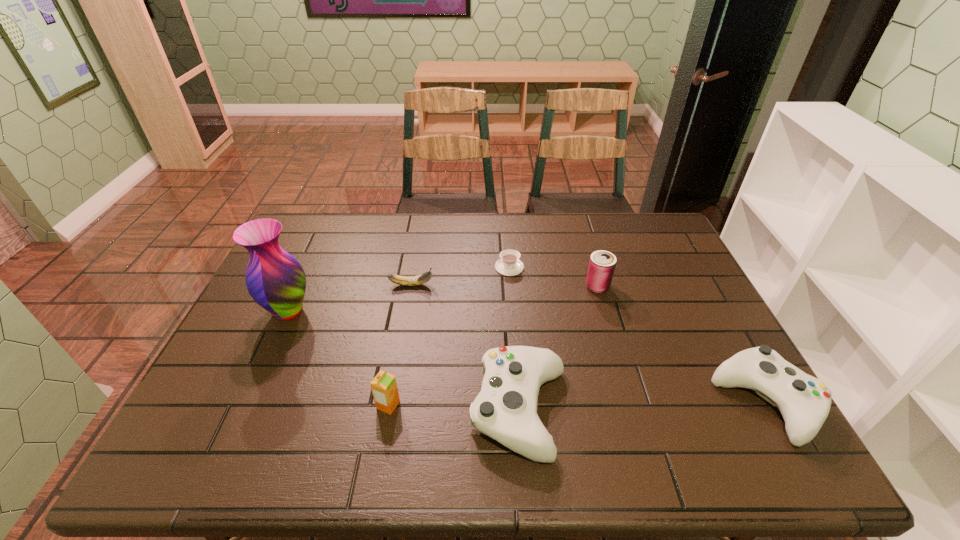
You are a GUI agent. You are given a task and a screenshot of the screen. Output one action in this format:
    pyautogui.click(x=<x>, y=<y>)
    Task: Click on the free space between the banana and the orange juice
    
    Given the screenshot: What is the action you would take?
    pyautogui.click(x=400, y=345)

I want to click on free space between the vase and the banana, so click(349, 298).

I want to click on free point between the leftmost object and the taller control, so click(x=404, y=361).

Where is `free space between the orange juice and the shortest object`? This screenshot has height=540, width=960. free space between the orange juice and the shortest object is located at coordinates (448, 336).

This screenshot has width=960, height=540. Find the location of `empty space between the banana and the left control`. empty space between the banana and the left control is located at coordinates (466, 348).

What are the coordinates of `empty space that is in between the second object from right to left and the orange juice` in the screenshot? It's located at (492, 346).

This screenshot has width=960, height=540. I want to click on free space between the second object from right to left and the vase, so click(443, 299).

This screenshot has height=540, width=960. I want to click on free space between the farthest object and the orange juice, so click(x=448, y=336).

You are a GUI agent. You are given a task and a screenshot of the screen. Output one action in this format:
    pyautogui.click(x=<x>, y=<y>)
    Task: Click on the object that is the second nearest to the vase
    The image size is (960, 540).
    Given the screenshot: What is the action you would take?
    pyautogui.click(x=384, y=388)

Where is `the fifth closest object relative to the farthest object`? The image size is (960, 540). the fifth closest object relative to the farthest object is located at coordinates (274, 278).